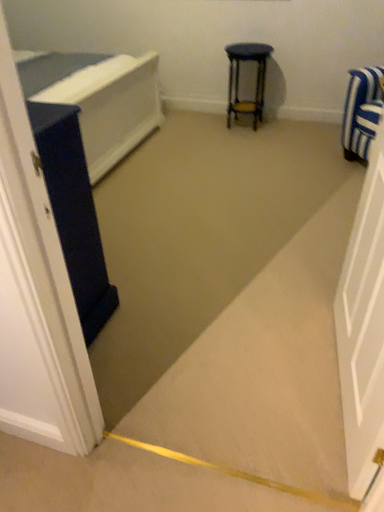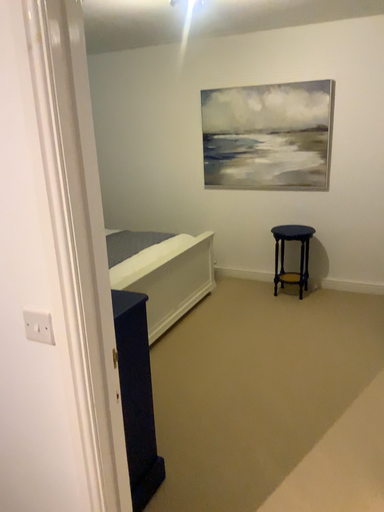
Question: Which way did the camera rotate in the video?

Choices:
 (A) rotated left
 (B) rotated right

Answer: (A)